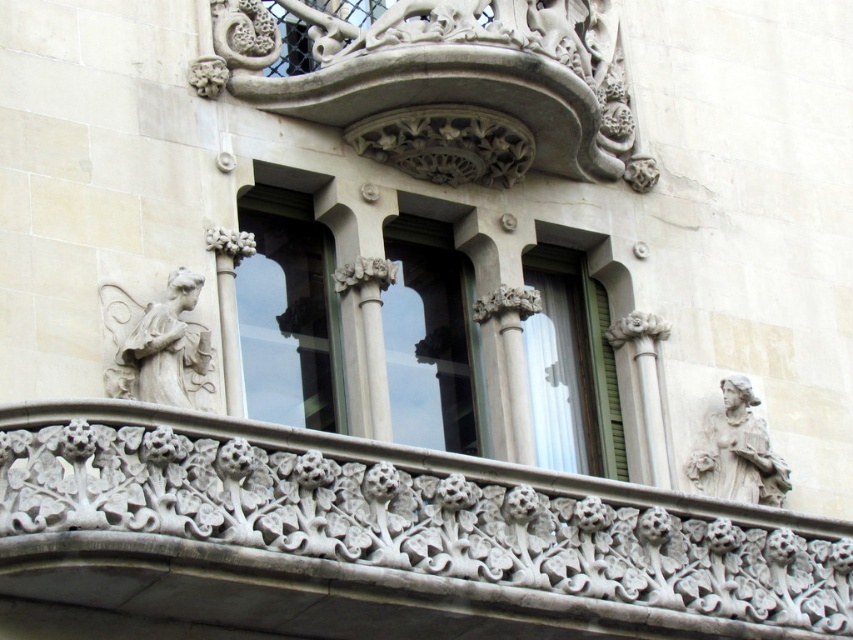
You are an architect analyzing the symmetry of the facade. Given the coordinates of the white stone angel at upper left, can you determine its position relative to the center of the facade?

The white stone angel at upper left is located at coordinates 0.537 on the x axis and 0.185 on the y axis, which places it slightly to the right and lower than the center of the facade.

You are an art student analyzing the architectural facade. You notice two white stone sculptures at the upper left corner. Which one is closer to you, the white stone angel at upper left or the white stone statue at upper left?

The white stone angel at upper left is closer to you because it is in front of the white stone statue at upper left.